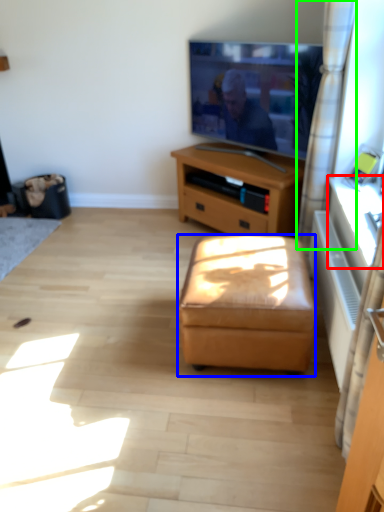
Question: Which is nearer to the table (highlighted by a red box)? stool (highlighted by a blue box) or curtain (highlighted by a green box).

Choices:
 (A) stool
 (B) curtain

Answer: (B)